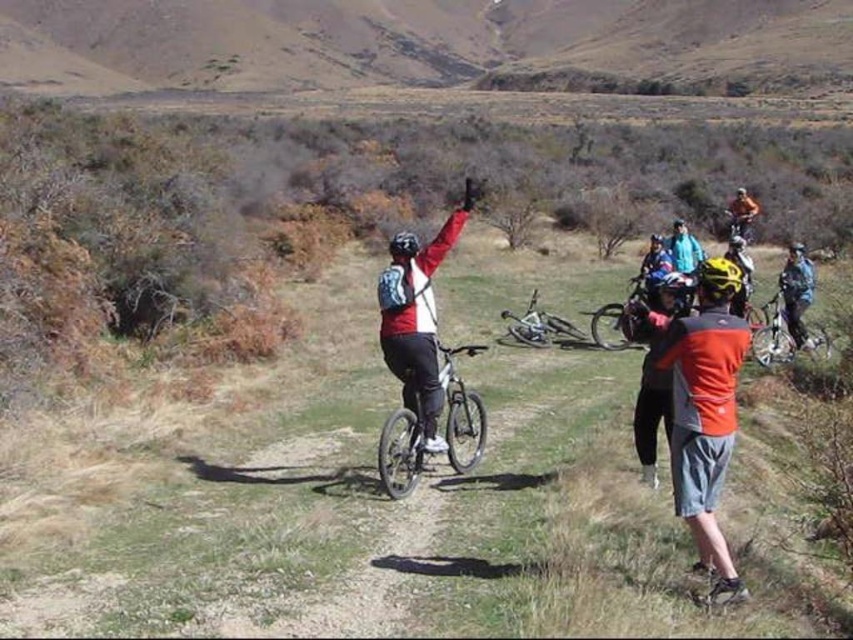
Question: Is dull brown hill at upper center to the left of matte black bicycle at center from the viewer's perspective?

Choices:
 (A) no
 (B) yes

Answer: (B)

Question: Among these objects, which one is farthest from the camera?

Choices:
 (A) shiny blue helmet at center
 (B) orange fabric shirt at center
 (C) matte black helmet at center

Answer: (C)

Question: Which point appears farthest from the camera in this image?

Choices:
 (A) (399, 260)
 (B) (701, 266)
 (C) (772, 332)
 (D) (409, 253)

Answer: (C)

Question: Among these points, which one is farthest from the camera?

Choices:
 (A) (480, 348)
 (B) (392, 268)

Answer: (A)

Question: Does shiny blue helmet at center lie in front of matte black helmet at center?

Choices:
 (A) no
 (B) yes

Answer: (B)

Question: Can you confirm if dull brown hill at upper center is positioned above orange fabric shirt at center?

Choices:
 (A) yes
 (B) no

Answer: (A)